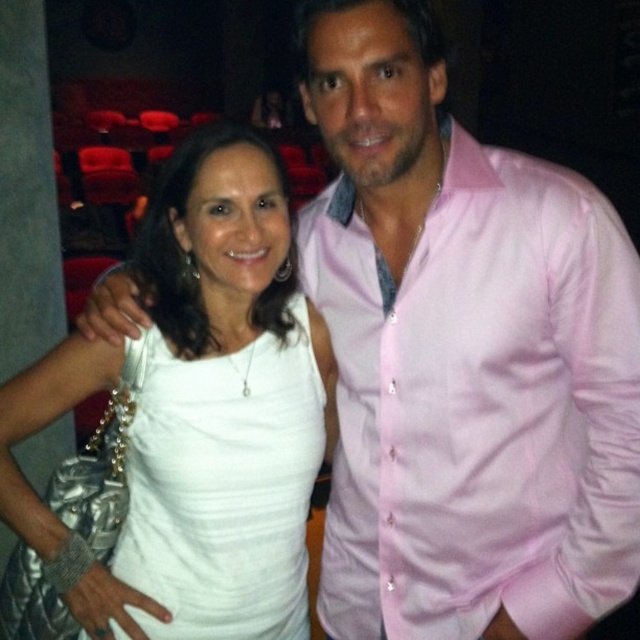
You are standing at point (269,284) and want to take a selfie with your phone which has a front camera with a maximum focus distance of 1.2 meters. Can you take a clear selfie without moving from this point?

The distance between you and the camera is 1.24 meters, which exceeds the maximum focus distance of 1.2 meters. Therefore, you cannot take a clear selfie from this position.

You are a photographer setting up for a photoshoot and need to ensure that both the white satin dress at center and the white ribbed tank top at center are visible in the frame. Based on their positions, which one is closer to the left edge of the image?

The white satin dress at center is positioned to the left of the white ribbed tank top at center, so it is closer to the left edge of the image.

You are a photographer trying to capture the perfect shot of the white satin dress at center. Where exactly should you position your camera to ensure the dress is in the center of the frame?

The white satin dress at center is located at point (189, 420), so you should position your camera to focus precisely on those coordinates to ensure the dress is centered in the frame.